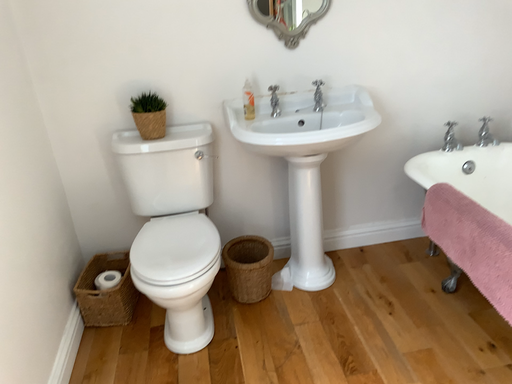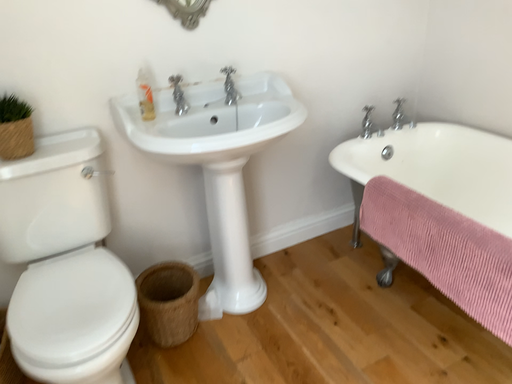
Question: Which way did the camera rotate in the video?

Choices:
 (A) rotated right
 (B) rotated left

Answer: (A)